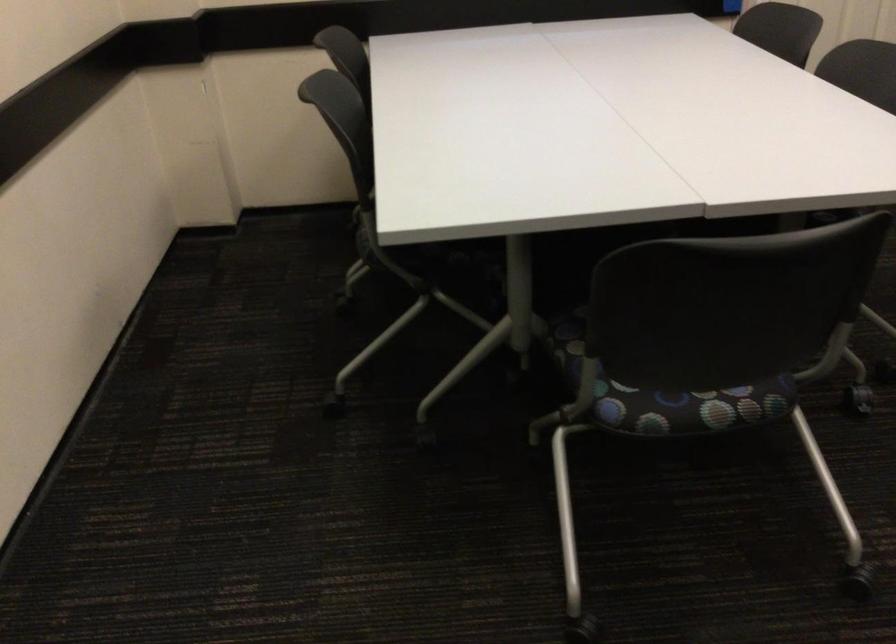
What do you see at coordinates (688, 406) in the screenshot? This screenshot has width=896, height=644. I see `the patterned chair sitting surface` at bounding box center [688, 406].